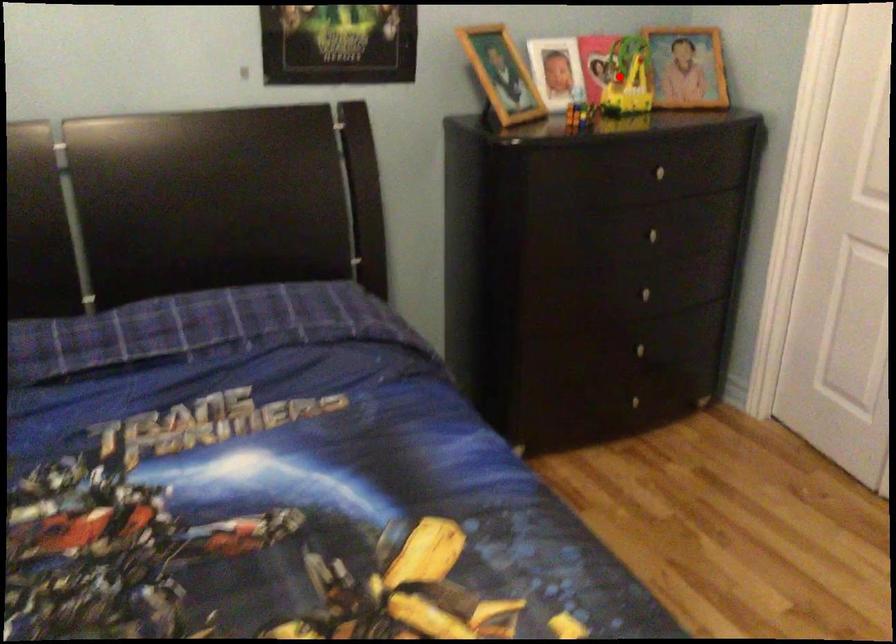
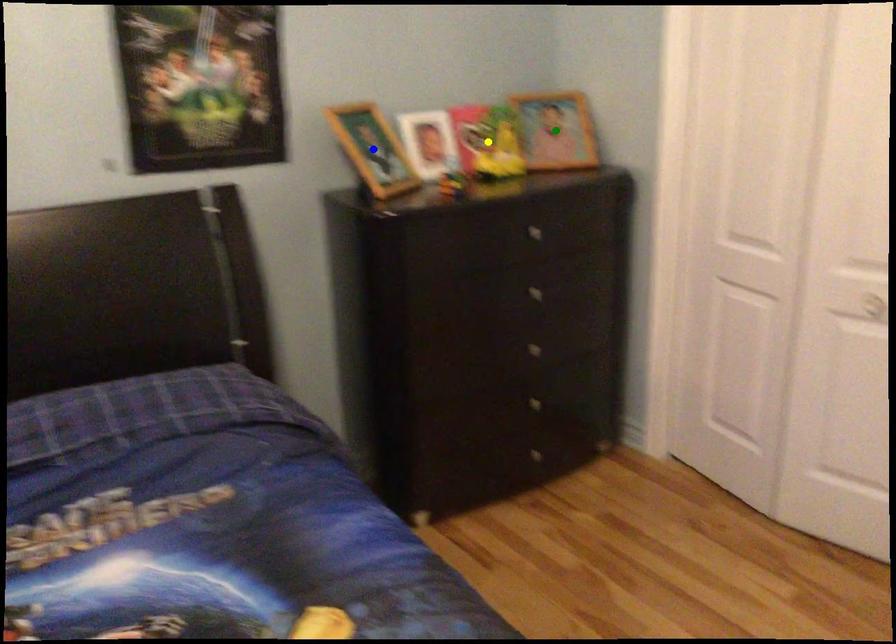
Question: I am providing you with two images of the same scene from different viewpoints. A red point is marked on the first image. You are given multiple points on the second image. Which point in image 2 represents the same 3d spot as the red point in image 1?

Choices:
 (A) yellow point
 (B) green point
 (C) blue point

Answer: (A)